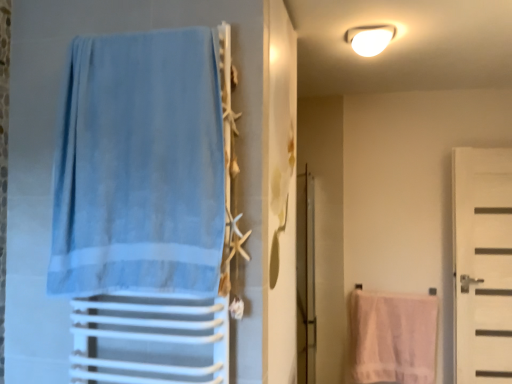
In order to face white matte door at right, should I rotate leftwards or rightwards?

You should look right and rotate roughly 28.089 degrees.

Measure the distance between white textured towel at lower right and camera.

white textured towel at lower right and camera are 10.14 feet apart.

What is the approximate width of light blue fabric towel at left?

It is 5.42 inches.

Locate an element on the screen. Image resolution: width=512 pixels, height=384 pixels. light blue fabric towel at left is located at coordinates (139, 167).

Describe the element at coordinates (370, 39) in the screenshot. The height and width of the screenshot is (384, 512). I see `white glossy light fixture at upper center` at that location.

At what (x,y) coordinates should I click in order to perform the action: click on white matte door at right. Please return your answer as a coordinate pair (x, y). The width and height of the screenshot is (512, 384). Looking at the image, I should click on (482, 264).

Identify the location of door on the right side of white textured towel at lower right. This screenshot has width=512, height=384. (482, 264).

From the image's perspective, is white textured towel at lower right located above or below white matte door at right?

Clearly, from the image's perspective, white textured towel at lower right is below white matte door at right.

Is white textured towel at lower right to the left of white matte door at right from the viewer's perspective?

Yes.

In the image, is white textured towel at lower right positioned in front of or behind white matte door at right?

white textured towel at lower right is positioned farther from the viewer than white matte door at right.

How different are the orientations of white glossy light fixture at upper center and light blue fabric towel at left in degrees?

82.6 degrees separate the facing orientations of white glossy light fixture at upper center and light blue fabric towel at left.

Is white glossy light fixture at upper center positioned behind light blue fabric towel at left?

That is True.

From their relative heights in the image, would you say white glossy light fixture at upper center is taller or shorter than light blue fabric towel at left?

In the image, white glossy light fixture at upper center appears to be shorter than light blue fabric towel at left.

Is white glossy light fixture at upper center next to light blue fabric towel at left and touching it?

No, white glossy light fixture at upper center is not in contact with light blue fabric towel at left.

Which is closer, (467, 323) or (349, 35)?

Point (467, 323).

Is white matte door at right taller than white glossy light fixture at upper center?

Yes.

Which of these two, white matte door at right or white glossy light fixture at upper center, is wider?

Wider between the two is white glossy light fixture at upper center.

Which is more to the left, white matte door at right or white glossy light fixture at upper center?

white glossy light fixture at upper center.

Between clear glass screen door at center and white matte door at right, which one has smaller size?

Smaller between the two is white matte door at right.

Would you say clear glass screen door at center is to the left or to the right of white matte door at right in the picture?

From the image, it's evident that clear glass screen door at center is to the left of white matte door at right.

Would you say clear glass screen door at center is a long distance from white matte door at right?

Indeed, clear glass screen door at center is not near white matte door at right.

Is white matte door at right next to white textured towel at lower right?

No, white matte door at right is not making contact with white textured towel at lower right.

Which is behind, white matte door at right or white textured towel at lower right?

white textured towel at lower right is further away from the camera.

Is light blue fabric towel at left to the left or to the right of clear glass screen door at center in the image?

light blue fabric towel at left is positioned on clear glass screen door at center's left side.

In the scene shown: Is the position of light blue fabric towel at left less distant than that of clear glass screen door at center?

Yes, light blue fabric towel at left is closer to the camera.

From the picture: Is light blue fabric towel at left facing towards clear glass screen door at center?

No, light blue fabric towel at left is not turned towards clear glass screen door at center.

Is light blue fabric towel at left to the left or to the right of white textured towel at lower right in the image?

Based on their positions, light blue fabric towel at left is located to the left of white textured towel at lower right.

Is there a large distance between light blue fabric towel at left and white textured towel at lower right?

That's right, there is a large distance between light blue fabric towel at left and white textured towel at lower right.

Is white textured towel at lower right inside light blue fabric towel at left?

No, white textured towel at lower right is located outside of light blue fabric towel at left.

Where is `door lying above the white textured towel at lower right (from the image's perspective)`? The width and height of the screenshot is (512, 384). door lying above the white textured towel at lower right (from the image's perspective) is located at coordinates (482, 264).

Locate an element on the screen. curtain located below the white glossy light fixture at upper center (from the image's perspective) is located at coordinates (139, 167).

Estimate the real-world distances between objects in this image. Which object is further from clear glass screen door at center, white glossy light fixture at upper center or light blue fabric towel at left?

light blue fabric towel at left lies further to clear glass screen door at center than the other object.

Consider the image. From the image, which object appears to be nearer to light blue fabric towel at left, clear glass screen door at center or white glossy light fixture at upper center?

The object closer to light blue fabric towel at left is clear glass screen door at center.

Estimate the real-world distances between objects in this image. Which object is closer to white glossy light fixture at upper center, light blue fabric towel at left or white textured towel at lower right?

light blue fabric towel at left.

Which object lies further to the anchor point white glossy light fixture at upper center, white textured towel at lower right or clear glass screen door at center?

The object further to white glossy light fixture at upper center is white textured towel at lower right.

Looking at the image, which one is located closer to light blue fabric towel at left, white glossy light fixture at upper center or white matte door at right?

white glossy light fixture at upper center is closer to light blue fabric towel at left.

Based on the photo, based on their spatial positions, is white matte door at right or light blue fabric towel at left closer to clear glass screen door at center?

light blue fabric towel at left.

Which object lies nearer to the anchor point light blue fabric towel at left, clear glass screen door at center or white matte door at right?

clear glass screen door at center is closer to light blue fabric towel at left.

Based on their spatial positions, is white glossy light fixture at upper center or white textured towel at lower right closer to white matte door at right?

Among the two, white textured towel at lower right is located nearer to white matte door at right.

Where is `beach towel situated between clear glass screen door at center and white matte door at right from left to right`? beach towel situated between clear glass screen door at center and white matte door at right from left to right is located at coordinates (393, 338).

You are a GUI agent. You are given a task and a screenshot of the screen. Output one action in this format:
    pyautogui.click(x=<x>, y=<y>)
    Task: Click on the door that lies between white glossy light fixture at upper center and white textured towel at lower right from top to bottom
    This screenshot has width=512, height=384.
    Given the screenshot: What is the action you would take?
    pyautogui.click(x=482, y=264)

The image size is (512, 384). Identify the location of curtain between white glossy light fixture at upper center and clear glass screen door at center in the vertical direction. (139, 167).

Locate an element on the screen. This screenshot has height=384, width=512. screen door between white glossy light fixture at upper center and white textured towel at lower right vertically is located at coordinates (305, 278).